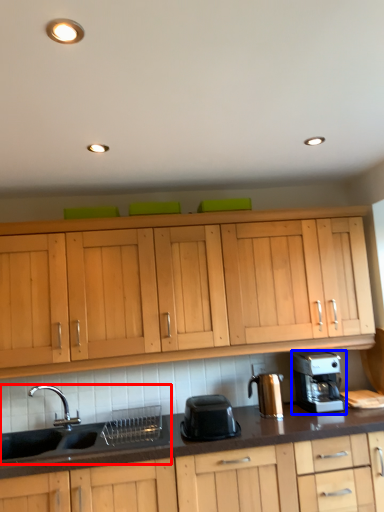
Question: Which object appears closest to the camera in this image, sink (highlighted by a red box) or home appliance (highlighted by a blue box)?

Choices:
 (A) sink
 (B) home appliance

Answer: (A)